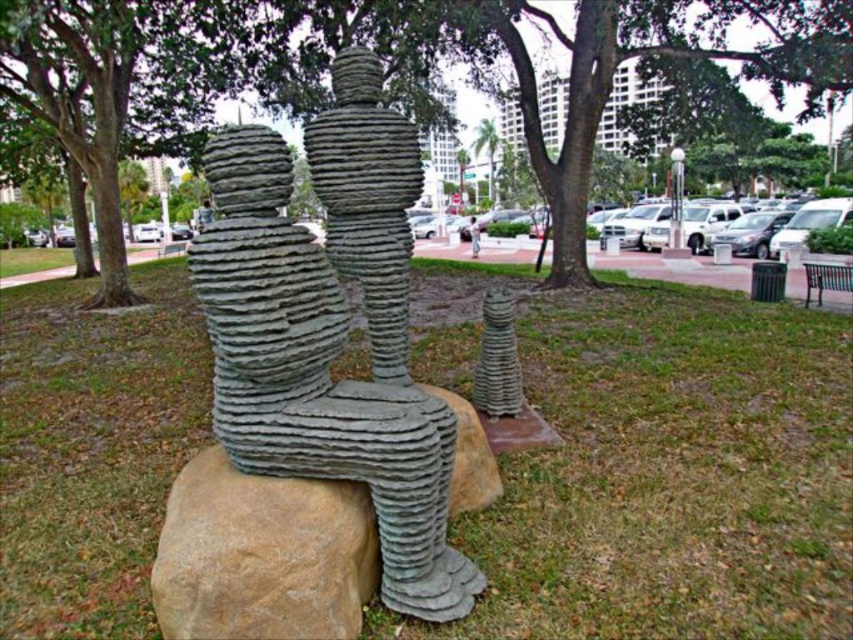
What are the coordinates of `green grass at center` in the screenshot? It's located at pos(653,464).

Can you confirm if green grass at center is bigger than brown rough stone at center?

Indeed, green grass at center has a larger size compared to brown rough stone at center.

Does point (709, 310) come closer to viewer compared to point (192, 616)?

No, (709, 310) is further to viewer.

In order to click on green grass at center in this screenshot , I will do `click(653, 464)`.

Who is lower down, light brown wooden bench at center or dark blue fabric jacket at upper center?

light brown wooden bench at center

Can you confirm if light brown wooden bench at center is smaller than dark blue fabric jacket at upper center?

Yes.

What do you see at coordinates (474, 236) in the screenshot?
I see `light brown wooden bench at center` at bounding box center [474, 236].

Identify the location of light brown wooden bench at center. The height and width of the screenshot is (640, 853). (474, 236).

Is point (474, 129) farther from viewer compared to point (477, 243)?

Yes, point (474, 129) is behind point (477, 243).

Identify the location of green leafy tree at center. (486, 152).